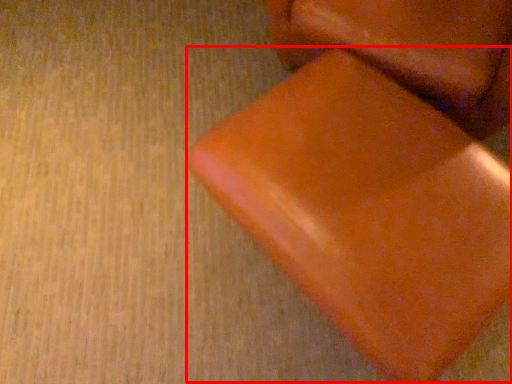
Question: From the image's perspective, where is bean bag chair (annotated by the red box) located in relation to furniture in the image?

Choices:
 (A) above
 (B) below

Answer: (B)